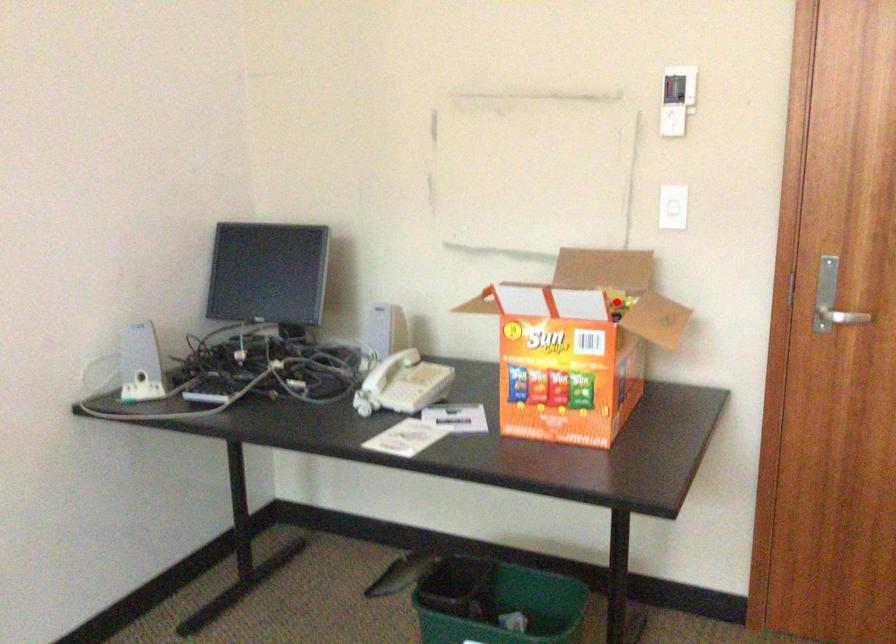
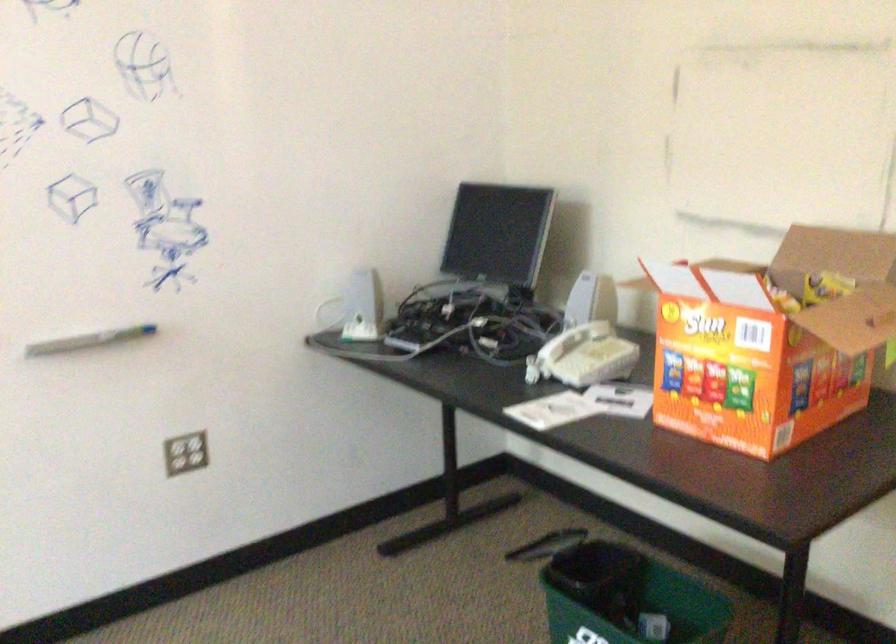
Question: I am providing you with two images of the same scene from different viewpoints. A red point is shown in image1. For the corresponding object point in image2, is it positioned nearer or farther from the camera?

Choices:
 (A) Nearer
 (B) Farther

Answer: (A)